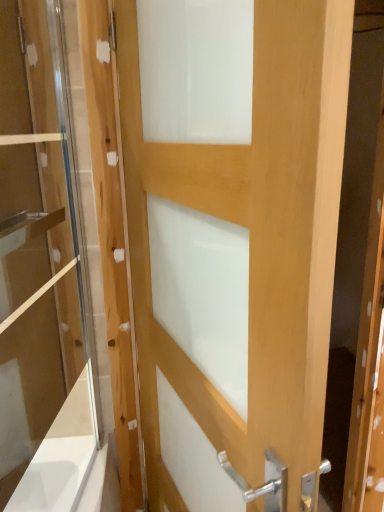
Describe the element at coordinates (233, 240) in the screenshot. This screenshot has width=384, height=512. I see `natural wood door at center` at that location.

Where is `natural wood door at center`? natural wood door at center is located at coordinates (x=233, y=240).

Find the location of `clear glass door at left`. clear glass door at left is located at coordinates (40, 259).

Image resolution: width=384 pixels, height=512 pixels. Describe the element at coordinates (40, 259) in the screenshot. I see `clear glass door at left` at that location.

Locate an element on the screen. natural wood door at center is located at coordinates (233, 240).

Which is more to the right, clear glass door at left or natural wood door at center?

natural wood door at center.

Is clear glass door at left positioned in front of natural wood door at center?

No, it is behind natural wood door at center.

Which is closer, [38,335] or [334,113]?

Point [38,335] appears to be farther away from the viewer than point [334,113].

From the image's perspective, which is above, clear glass door at left or natural wood door at center?

From the image's view, clear glass door at left is above.

From a real-world perspective, is clear glass door at left positioned under natural wood door at center based on gravity?

Incorrect, from a real-world perspective, clear glass door at left is higher than natural wood door at center.

Does clear glass door at left have a greater width compared to natural wood door at center?

No, clear glass door at left is not wider than natural wood door at center.

Based on the photo, is clear glass door at left taller or shorter than natural wood door at center?

Considering their sizes, clear glass door at left has less height than natural wood door at center.

Is clear glass door at left smaller than natural wood door at center?

Yes, clear glass door at left is smaller than natural wood door at center.

Would you say clear glass door at left is inside or outside natural wood door at center?

clear glass door at left is not inside natural wood door at center, it's outside.

Are clear glass door at left and natural wood door at center far apart?

No, there isn't a large distance between clear glass door at left and natural wood door at center.

Could you tell me if clear glass door at left is turned towards natural wood door at center?

Yes, clear glass door at left is oriented towards natural wood door at center.

What are the coordinates of `door beneath the clear glass door at left (from a real-world perspective)` in the screenshot? It's located at tap(233, 240).

Would you say natural wood door at center is to the left or to the right of clear glass door at left in the picture?

natural wood door at center is positioned on clear glass door at left's right side.

Does natural wood door at center lie in front of clear glass door at left?

Yes, it is.

Which point is more distant from viewer, (249, 406) or (13, 152)?

Point (13, 152)

From the image's perspective, between natural wood door at center and clear glass door at left, which one is located above?

clear glass door at left, from the image's perspective.

From a real-world perspective, who is located lower, natural wood door at center or clear glass door at left?

natural wood door at center is physically lower.

Does natural wood door at center have a greater width compared to clear glass door at left?

Correct, the width of natural wood door at center exceeds that of clear glass door at left.

Considering the sizes of natural wood door at center and clear glass door at left in the image, is natural wood door at center taller or shorter than clear glass door at left?

In the image, natural wood door at center appears to be taller than clear glass door at left.

Between natural wood door at center and clear glass door at left, which one has smaller size?

clear glass door at left.

Is natural wood door at center not within clear glass door at left?

Yes, natural wood door at center is located beyond the bounds of clear glass door at left.

Is natural wood door at center with clear glass door at left?

No, natural wood door at center is not making contact with clear glass door at left.

Is clear glass door at left at the back of natural wood door at center?

Yes, natural wood door at center's orientation is away from clear glass door at left.

Measure the distance between natural wood door at center and clear glass door at left.

natural wood door at center is 14.42 inches away from clear glass door at left.

Locate an element on the screen. The image size is (384, 512). door in front of the clear glass door at left is located at coordinates click(233, 240).

Find the location of a particular element. This screenshot has height=512, width=384. screen door that appears behind the natural wood door at center is located at coordinates (40, 259).

In the image, there is a clear glass door at left. Where is `door below it (from a real-world perspective)`? door below it (from a real-world perspective) is located at coordinates (233, 240).